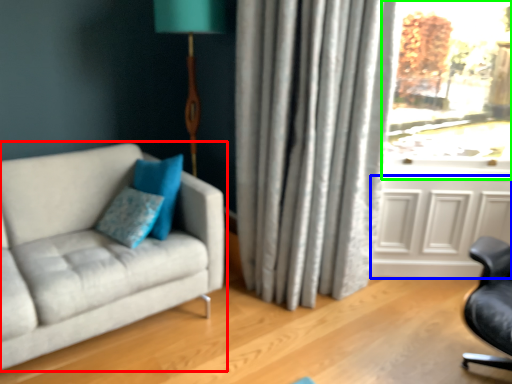
Question: Which object is positioned farthest from studio couch (highlighted by a red box)? Select from screen door (highlighted by a blue box) and window (highlighted by a green box).

Choices:
 (A) screen door
 (B) window

Answer: (B)